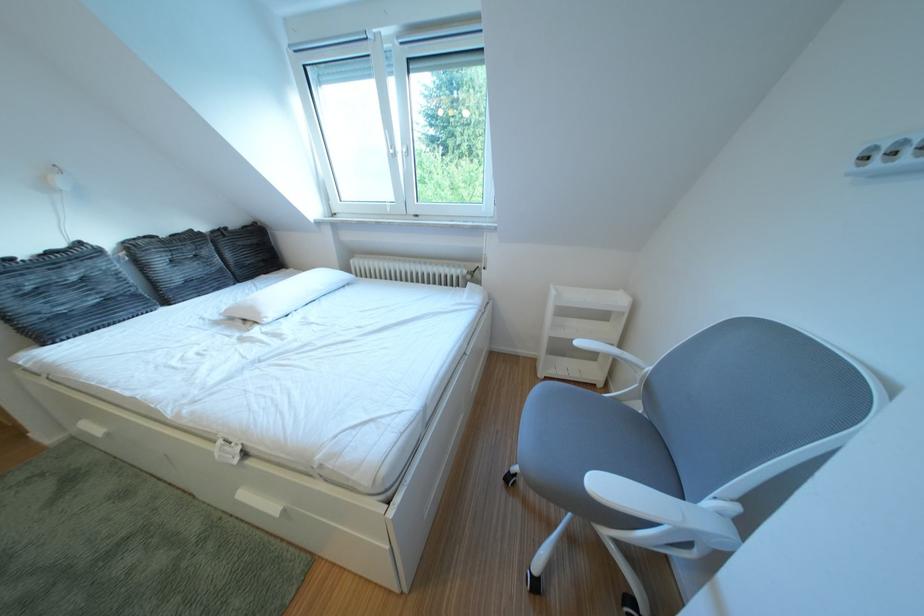
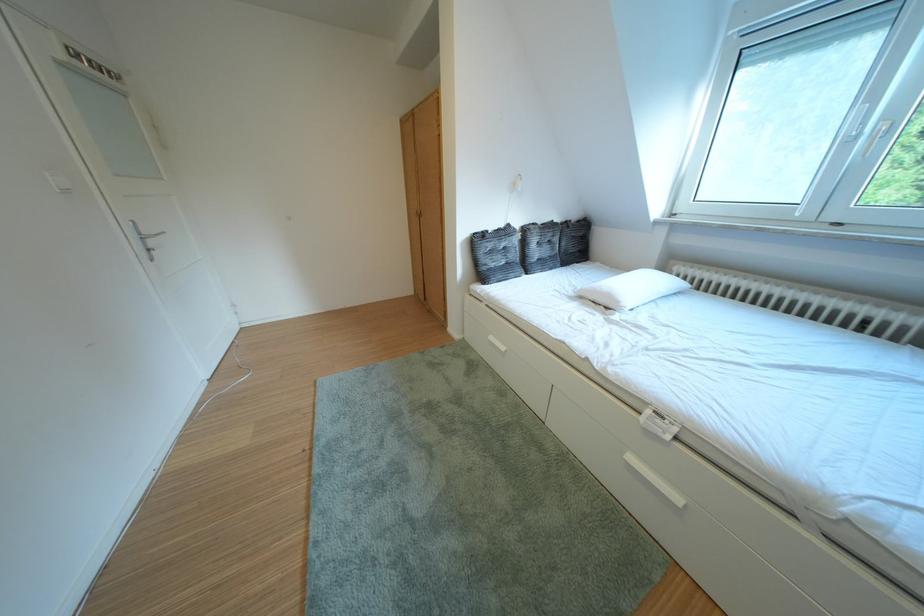
Find the pixel in the second image that matches point (265, 314) in the first image.

(623, 301)